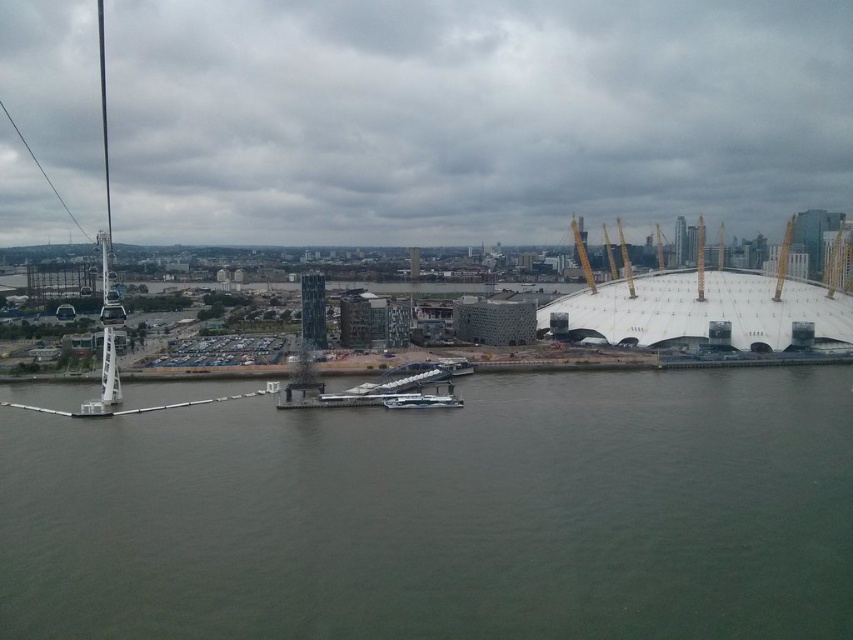
Which is behind, point (12, 460) or point (448, 388)?

The point (448, 388) is more distant.

Does greenish-gray water at center have a lesser height compared to metallic silver boat at center?

Incorrect, greenish-gray water at center's height does not fall short of metallic silver boat at center's.

You are a GUI agent. You are given a task and a screenshot of the screen. Output one action in this format:
    pyautogui.click(x=<x>, y=<y>)
    Task: Click on the greenish-gray water at center
    
    Given the screenshot: What is the action you would take?
    pyautogui.click(x=444, y=515)

At what (x,y) coordinates should I click in order to perform the action: click on greenish-gray water at center. Please return your answer as a coordinate pair (x, y). Looking at the image, I should click on (444, 515).

Between greenish-gray water at center and white glossy boat at center, which one has more height?

greenish-gray water at center is taller.

Find the location of a particular element. This screenshot has height=640, width=853. greenish-gray water at center is located at coordinates (444, 515).

Based on the photo, does metallic silver boat at center have a lesser height compared to white glossy boat at center?

No, metallic silver boat at center is not shorter than white glossy boat at center.

Who is positioned more to the right, metallic silver boat at center or white glossy boat at center?

From the viewer's perspective, white glossy boat at center appears more on the right side.

The image size is (853, 640). Describe the element at coordinates (425, 400) in the screenshot. I see `metallic silver boat at center` at that location.

You are a GUI agent. You are given a task and a screenshot of the screen. Output one action in this format:
    pyautogui.click(x=<x>, y=<y>)
    Task: Click on the metallic silver boat at center
    This screenshot has width=853, height=640.
    Given the screenshot: What is the action you would take?
    pyautogui.click(x=425, y=400)